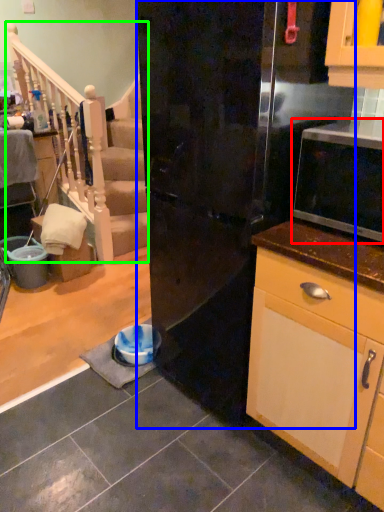
Question: Considering the real-world distances, which object is farthest from microwave oven (highlighted by a red box)? refrigerator (highlighted by a blue box) or rail (highlighted by a green box)?

Choices:
 (A) refrigerator
 (B) rail

Answer: (B)